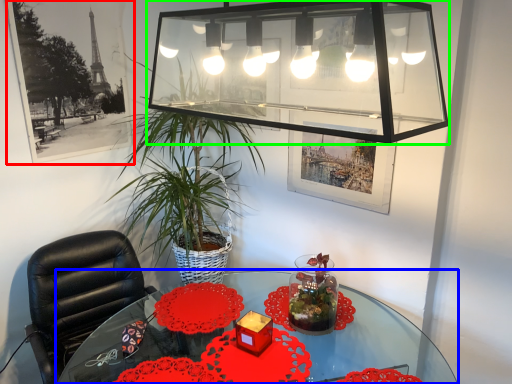
Question: Which object is positioned closest to picture frame (highlighted by a red box)? Select from table (highlighted by a blue box) and glass box (highlighted by a green box).

Choices:
 (A) table
 (B) glass box

Answer: (B)